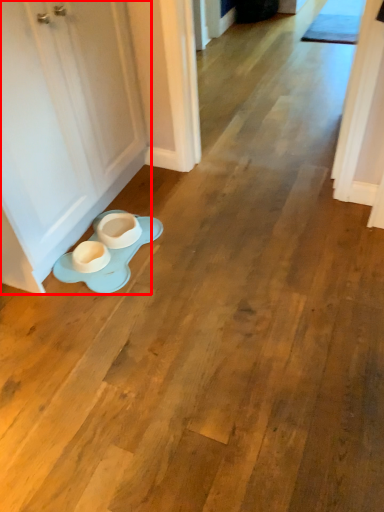
Question: Observing the image, what is the correct spatial positioning of door (annotated by the red box) in reference to saucer?

Choices:
 (A) right
 (B) left

Answer: (B)